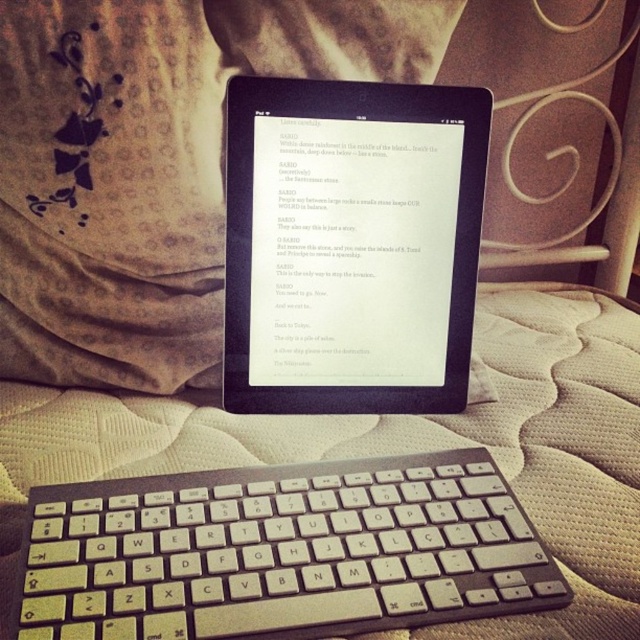
Is point (172, 520) in front of point (412, 365)?

Yes, it is.

Is white plastic keyboard at center bigger than black matte tablet at center?

Yes.

Is point (371, 508) closer to viewer compared to point (337, 92)?

Yes.

Find the location of a particular element. Image resolution: width=640 pixels, height=640 pixels. white plastic keyboard at center is located at coordinates (282, 552).